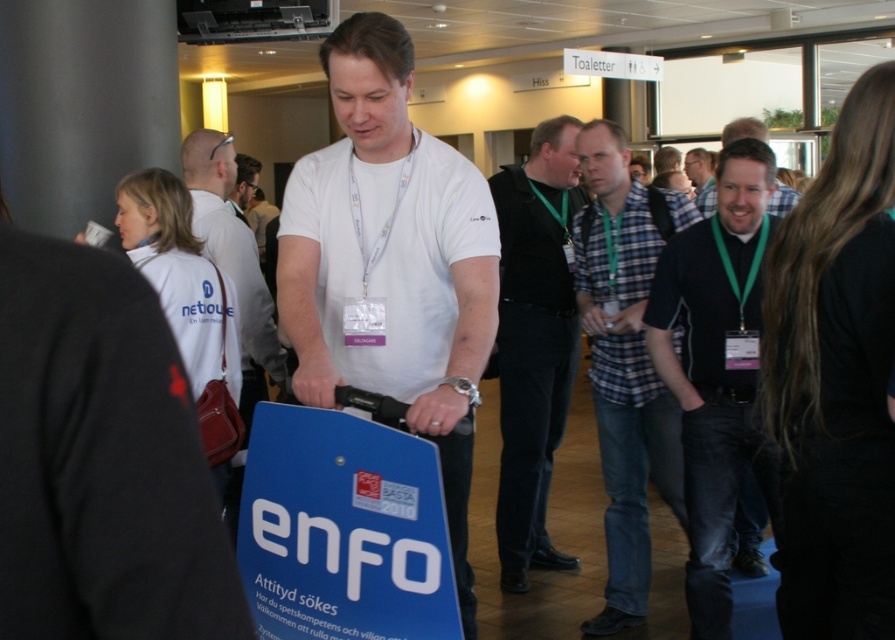
Question: Can you confirm if black smooth vest at center is positioned above green checkered shirt at center?

Choices:
 (A) no
 (B) yes

Answer: (A)

Question: Does black shirt at center appear on the left side of plaid cotton shirt at center?

Choices:
 (A) no
 (B) yes

Answer: (A)

Question: Which of the following is the closest to the observer?

Choices:
 (A) black smooth vest at center
 (B) white matte shirt at center
 (C) black shirt at center

Answer: (C)

Question: Which object is the farthest from the matte white shirt at center?

Choices:
 (A) black smooth vest at center
 (B) white matte t-shirt at center
 (C) white matte shirt at center
 (D) plaid cotton shirt at center

Answer: (B)

Question: Which object appears closest to the camera in this image?

Choices:
 (A) white matte t-shirt at center
 (B) black smooth vest at center
 (C) white matte shirt at center
 (D) black shirt at center

Answer: (A)

Question: Can you confirm if white matte t-shirt at center is wider than plaid cotton shirt at center?

Choices:
 (A) no
 (B) yes

Answer: (B)